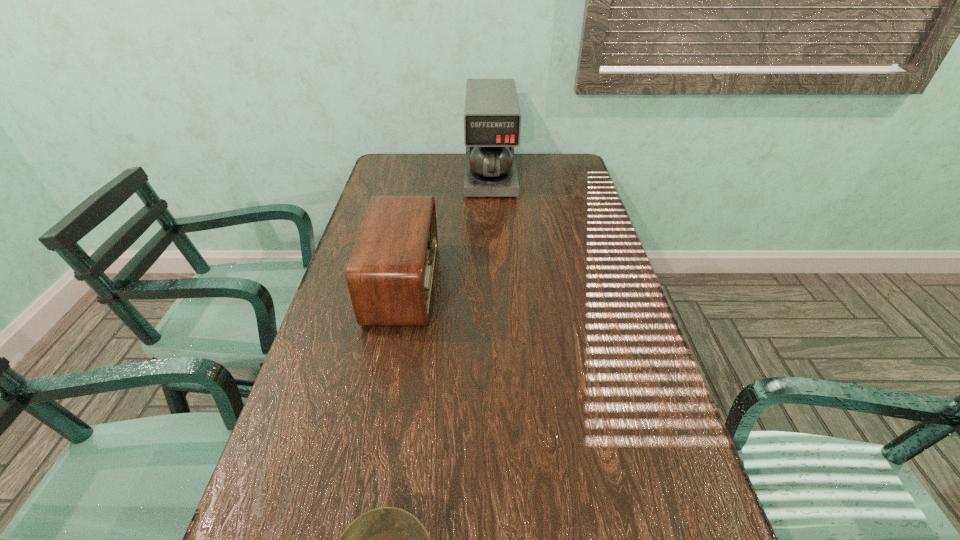
At what (x,y) coordinates should I click in order to perform the action: click on blank space at the right edge. Please return your answer as a coordinate pair (x, y). The image size is (960, 540). Looking at the image, I should click on (602, 243).

In the image, there is a desktop. Identify the location of free space at the far left corner. (391, 180).

In the image, there is a desktop. Find the location of `vacant region at the far right corner`. vacant region at the far right corner is located at coordinates (562, 163).

The width and height of the screenshot is (960, 540). In order to click on vacant region between the radio receiver and the farthest object in this screenshot , I will do `click(446, 229)`.

Where is `free spot between the second shortest object and the tallest object`? free spot between the second shortest object and the tallest object is located at coordinates (446, 229).

Point out which object is positioned as the second nearest to the shortest object. Please provide its 2D coordinates. Your answer should be formatted as a tuple, i.e. [(x, y)], where the tuple contains the x and y coordinates of a point satisfying the conditions above.

[(492, 119)]

This screenshot has width=960, height=540. In order to click on the closest object to the radio receiver in this screenshot , I will do `click(492, 119)`.

Identify the location of vacant area in the image that satisfies the following two spatial constraints: 1. on the carafe side of the tallest object; 2. on the front panel of the radio receiver. The height and width of the screenshot is (540, 960). (494, 283).

Locate an element on the screen. Image resolution: width=960 pixels, height=540 pixels. free point that satisfies the following two spatial constraints: 1. on the carafe side of the farthest object; 2. on the front panel of the second tallest object is located at coordinates (494, 283).